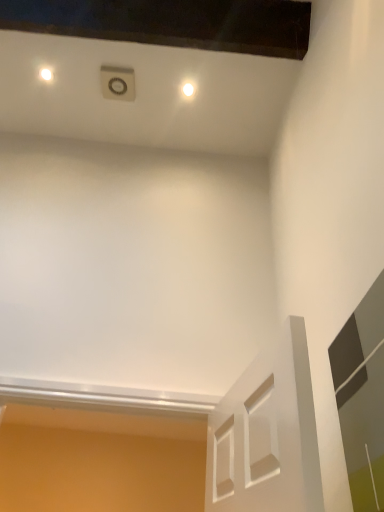
Question: Considering the positions of point (183, 86) and point (362, 304), is point (183, 86) closer or farther from the camera than point (362, 304)?

Choices:
 (A) closer
 (B) farther

Answer: (B)

Question: From the image's perspective, is white glossy light at upper center positioned above or below transparent glass door at right?

Choices:
 (A) above
 (B) below

Answer: (A)

Question: Is white glossy light at upper center to the left or to the right of transparent glass door at right in the image?

Choices:
 (A) left
 (B) right

Answer: (A)

Question: Does point (354, 349) appear closer or farther from the camera than point (190, 96)?

Choices:
 (A) farther
 (B) closer

Answer: (B)

Question: Relative to white glossy light at upper center, is transparent glass door at right in front or behind?

Choices:
 (A) behind
 (B) front

Answer: (B)

Question: From a real-world perspective, is transparent glass door at right above or below white glossy light at upper center?

Choices:
 (A) below
 (B) above

Answer: (A)

Question: In the image, is transparent glass door at right on the left side or the right side of white glossy light at upper center?

Choices:
 (A) left
 (B) right

Answer: (B)